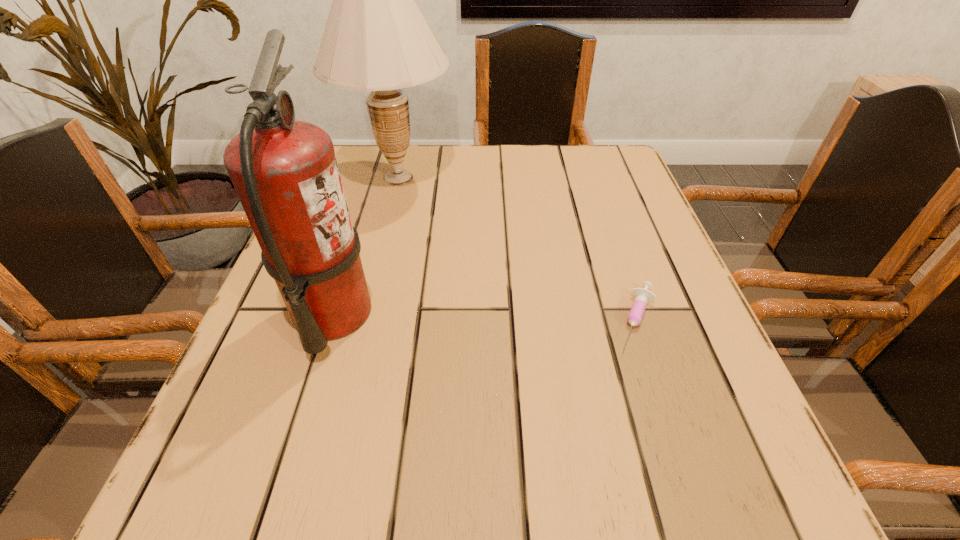
Find the location of a particular element. The height and width of the screenshot is (540, 960). free location that satisfies the following two spatial constraints: 1. toward the nozzle of the fire extinguisher; 2. on the back side of the rightmost object is located at coordinates (331, 319).

At what (x,y) coordinates should I click in order to perform the action: click on vacant region that satisfies the following two spatial constraints: 1. toward the nozzle of the rightmost object; 2. on the right side of the fire extinguisher. Please return your answer as a coordinate pair (x, y). Looking at the image, I should click on (331, 319).